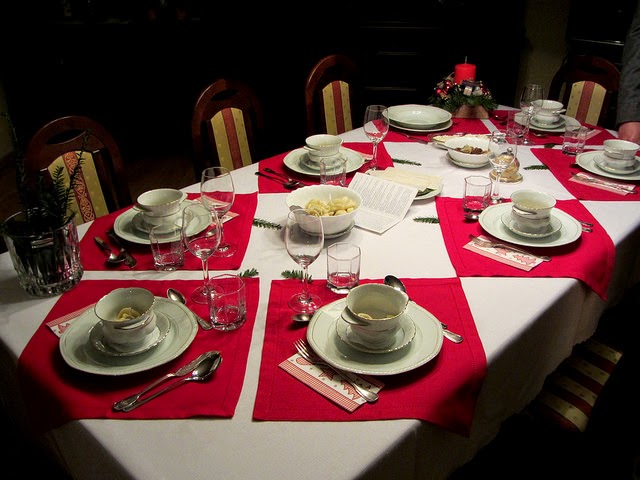
You are a GUI agent. You are given a task and a screenshot of the screen. Output one action in this format:
    pyautogui.click(x=<x>, y=<y>)
    Task: Click on the chairs
    The width and height of the screenshot is (640, 480).
    Given the screenshot: What is the action you would take?
    tap(77, 148), tap(219, 124), tap(326, 97), tap(588, 102), tap(602, 388)